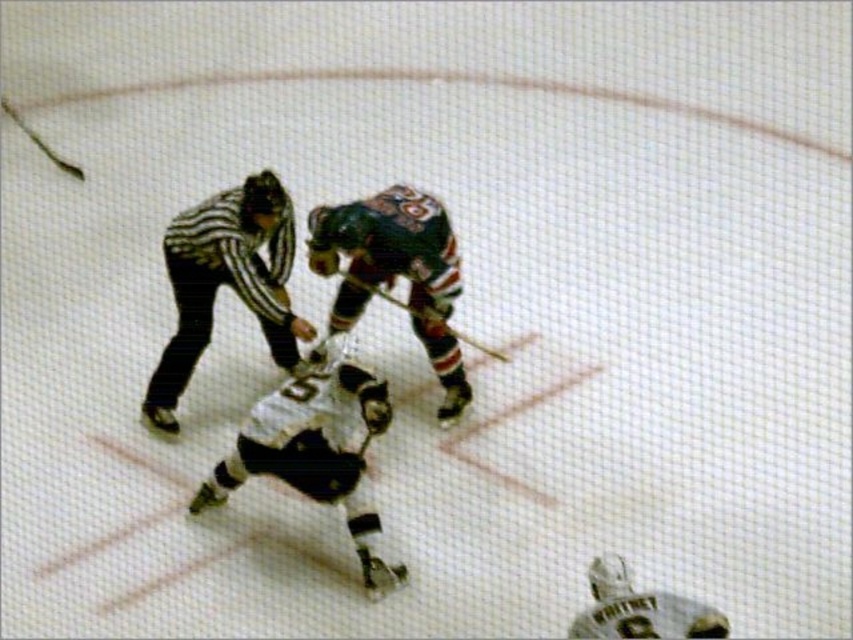
Question: Which of the following is the closest to the observer?

Choices:
 (A) (358, 225)
 (B) (614, 586)

Answer: (B)

Question: Based on their relative distances, which object is nearer to the white matte helmet at lower right?

Choices:
 (A) striped jersey referee at center
 (B) wooden hockey stick at center

Answer: (B)

Question: Is white matte hockey player at center above shiny green hockey stick at center?

Choices:
 (A) no
 (B) yes

Answer: (A)

Question: Which point is closer to the camera?

Choices:
 (A) white matte hockey player at center
 (B) shiny green hockey stick at center
 (C) white matte helmet at lower right
 (D) striped jersey referee at center

Answer: (C)

Question: Does white matte hockey player at center appear under white matte helmet at lower right?

Choices:
 (A) no
 (B) yes

Answer: (A)

Question: Can you confirm if white matte hockey player at center is positioned above shiny green hockey stick at center?

Choices:
 (A) no
 (B) yes

Answer: (A)